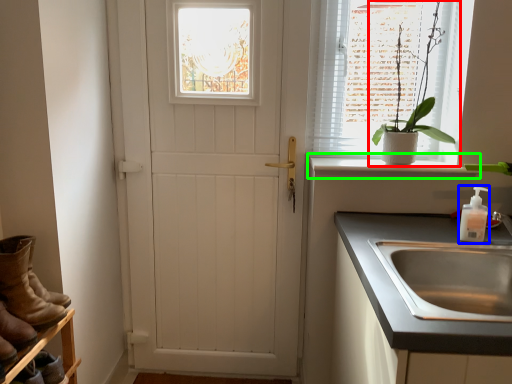
Question: Based on their relative distances, which object is farther from houseplant (highlighted by a red box)? Choose from soap dispenser (highlighted by a blue box) and window sill (highlighted by a green box).

Choices:
 (A) soap dispenser
 (B) window sill

Answer: (A)